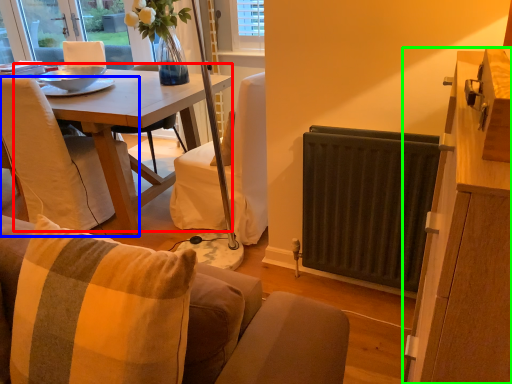
Question: Which object is the farthest from table (highlighted by a red box)? Choose among these: chair (highlighted by a blue box) or cabinetry (highlighted by a green box).

Choices:
 (A) chair
 (B) cabinetry

Answer: (B)